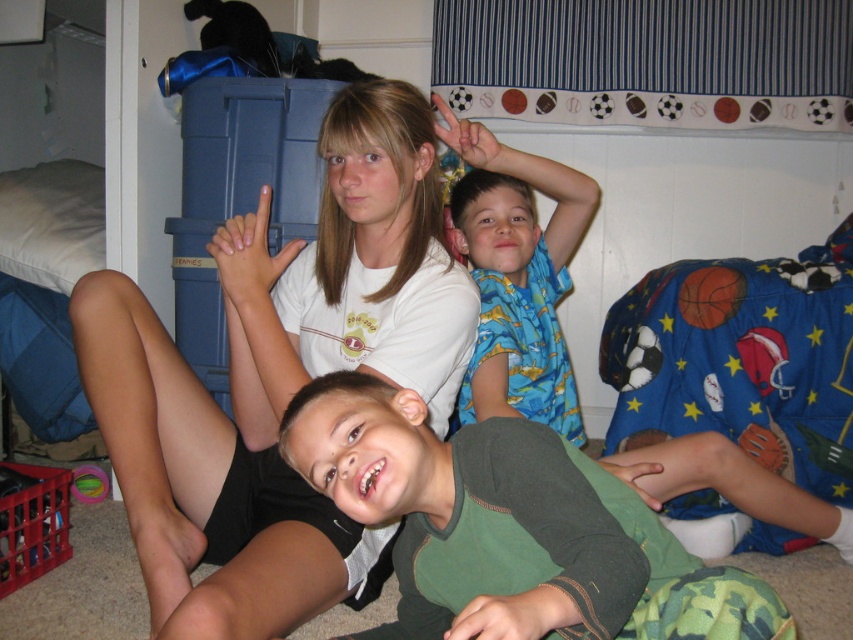
Question: Is blue pajama at upper right in front of green rubber ball at lower left?

Choices:
 (A) no
 (B) yes

Answer: (B)

Question: In this image, where is white matte shirt at upper center located relative to green soft shirt at center?

Choices:
 (A) above
 (B) below

Answer: (A)

Question: Which point is closer to the camera?

Choices:
 (A) (239, 371)
 (B) (399, 561)
 (C) (664, 461)
 (D) (79, 480)

Answer: (B)

Question: Which point is closer to the camera?

Choices:
 (A) green rubber ball at lower left
 (B) blue pajama at upper right

Answer: (B)

Question: Which object appears closest to the camera in this image?

Choices:
 (A) green rubber ball at lower left
 (B) white matte shirt at upper center
 (C) green soft shirt at center

Answer: (C)

Question: Does green soft shirt at center appear on the left side of green rubber ball at lower left?

Choices:
 (A) yes
 (B) no

Answer: (B)